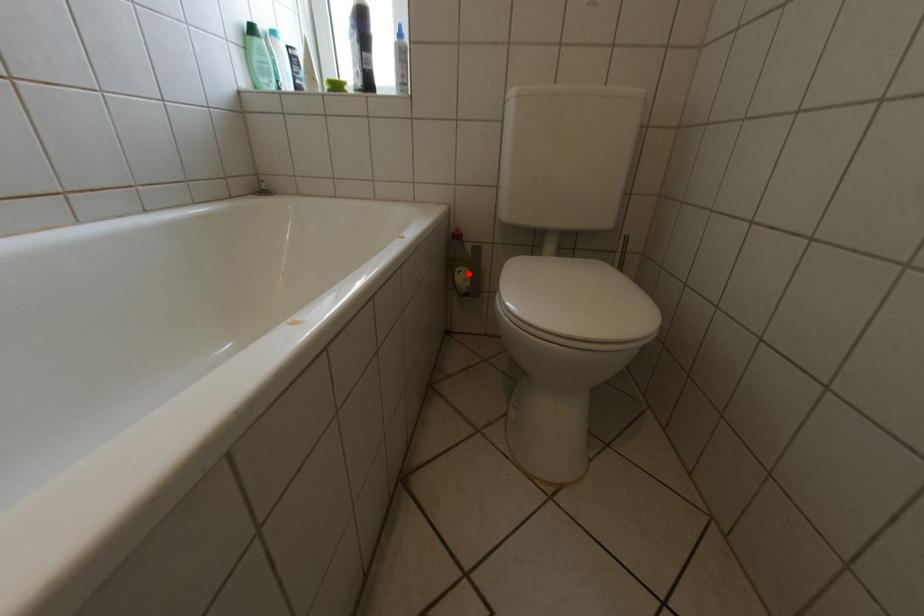
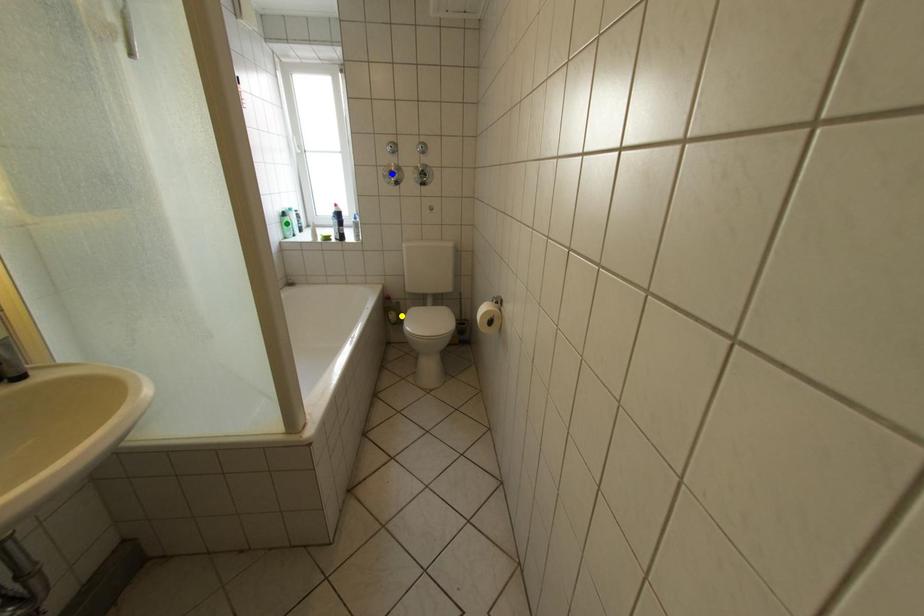
Question: I am providing you with two images of the same scene from different viewpoints. A red point is marked on the first image. You are given multiple points on the second image. Which point in image 2 represents the same 3d spot as the red point in image 1?

Choices:
 (A) blue point
 (B) yellow point
 (C) green point

Answer: (B)